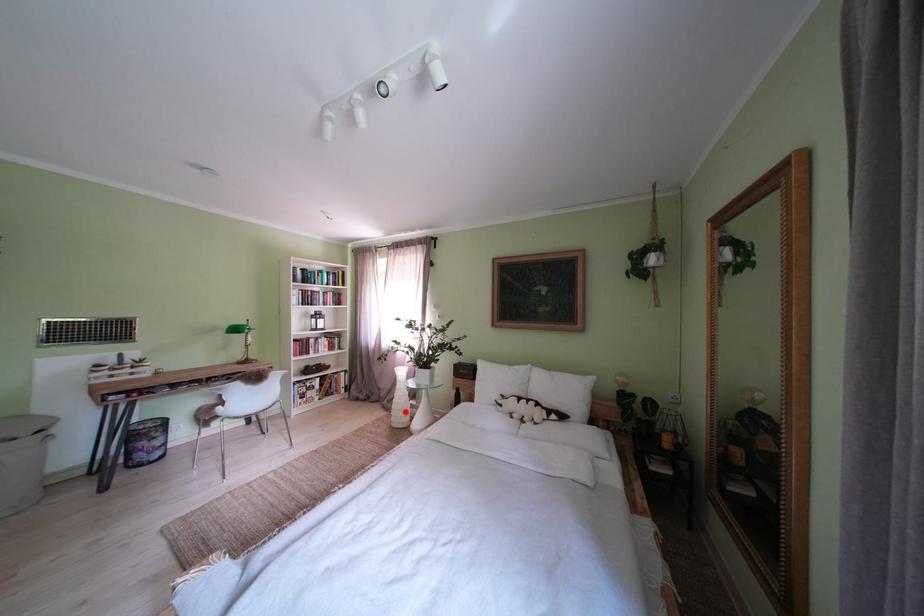
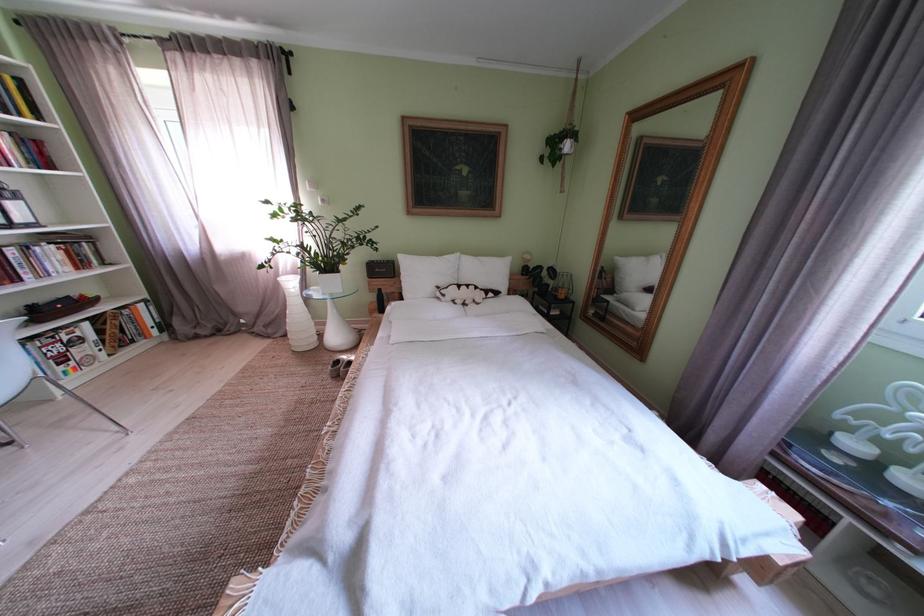
Question: I am providing you with two images of the same scene from different viewpoints. A red point is marked on the first image. Is the red point's position out of view in image 2?

Choices:
 (A) Yes
 (B) No

Answer: (B)